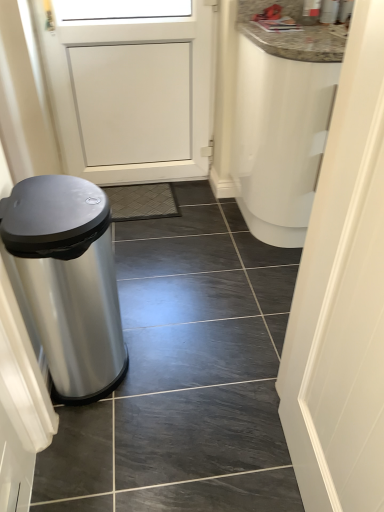
Question: Is slate tile at left completely or partially outside of polished stainless steel trash can at left?

Choices:
 (A) yes
 (B) no

Answer: (A)

Question: From the image's perspective, is slate tile at left above polished stainless steel trash can at left?

Choices:
 (A) yes
 (B) no

Answer: (A)

Question: Could polished stainless steel trash can at left be considered to be inside slate tile at left?

Choices:
 (A) yes
 (B) no

Answer: (B)

Question: Can you confirm if slate tile at left is bigger than polished stainless steel trash can at left?

Choices:
 (A) no
 (B) yes

Answer: (A)

Question: Is slate tile at left in contact with polished stainless steel trash can at left?

Choices:
 (A) no
 (B) yes

Answer: (A)

Question: Considering the relative positions of polished stainless steel trash can at left and slate tile at left in the image provided, is polished stainless steel trash can at left to the left or to the right of slate tile at left?

Choices:
 (A) right
 (B) left

Answer: (B)

Question: Considering the positions of point (94, 265) and point (198, 402), is point (94, 265) closer or farther from the camera than point (198, 402)?

Choices:
 (A) closer
 (B) farther

Answer: (A)

Question: Is polished stainless steel trash can at left in front of or behind slate tile at left in the image?

Choices:
 (A) behind
 (B) front

Answer: (B)

Question: Based on their sizes in the image, would you say polished stainless steel trash can at left is bigger or smaller than slate tile at left?

Choices:
 (A) big
 (B) small

Answer: (A)

Question: From a real-world perspective, is white matte door at right positioned above or below polished stainless steel trash can at left?

Choices:
 (A) below
 (B) above

Answer: (B)

Question: Considering the positions of point (372, 454) and point (24, 220), is point (372, 454) closer or farther from the camera than point (24, 220)?

Choices:
 (A) closer
 (B) farther

Answer: (A)

Question: Which is correct: white matte door at right is inside polished stainless steel trash can at left, or outside of it?

Choices:
 (A) inside
 (B) outside

Answer: (B)

Question: Is white matte door at right bigger or smaller than polished stainless steel trash can at left?

Choices:
 (A) small
 (B) big

Answer: (A)

Question: From the image's perspective, is white matte door at right positioned above or below slate tile at left?

Choices:
 (A) below
 (B) above

Answer: (A)

Question: Considering the positions of white matte door at right and slate tile at left in the image, is white matte door at right wider or thinner than slate tile at left?

Choices:
 (A) wide
 (B) thin

Answer: (B)